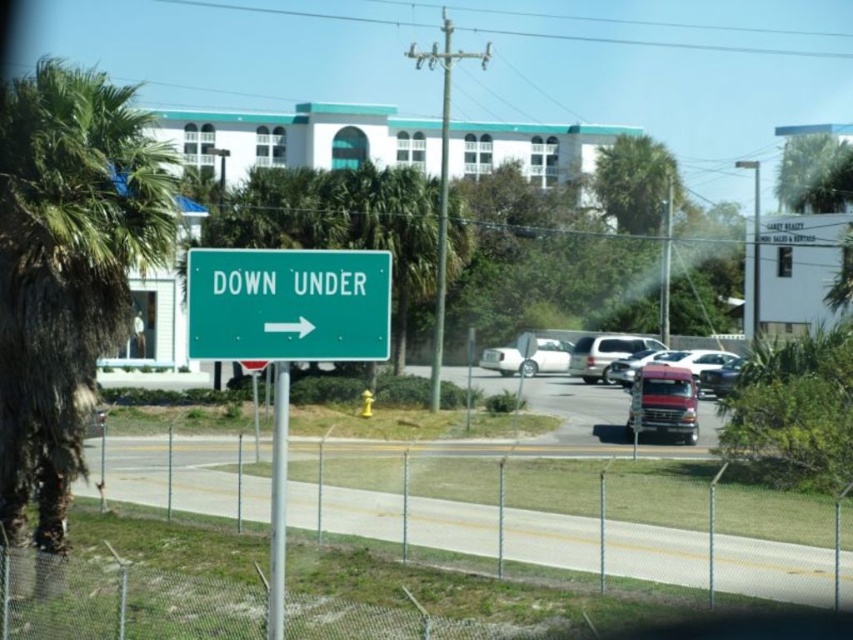
Who is more forward, (550, 339) or (631, 381)?

Point (631, 381) is in front.

Who is positioned more to the right, white matte sedan at center or metallic red truck at center?

metallic red truck at center

This screenshot has height=640, width=853. I want to click on white matte sedan at center, so click(x=527, y=356).

Is the position of metallic pole at center more distant than that of metallic red truck at center?

No, metallic pole at center is closer to the viewer.

This screenshot has width=853, height=640. I want to click on metallic pole at center, so click(x=277, y=500).

Is green plastic sign at center to the right of metallic pole at center from the viewer's perspective?

Indeed, green plastic sign at center is positioned on the right side of metallic pole at center.

Which is more to the right, green plastic sign at center or metallic pole at center?

green plastic sign at center is more to the right.

Who is more distant from viewer, (x=318, y=342) or (x=280, y=490)?

The point (x=318, y=342) is behind.

Find the location of `green plastic sign at center`. green plastic sign at center is located at coordinates (288, 305).